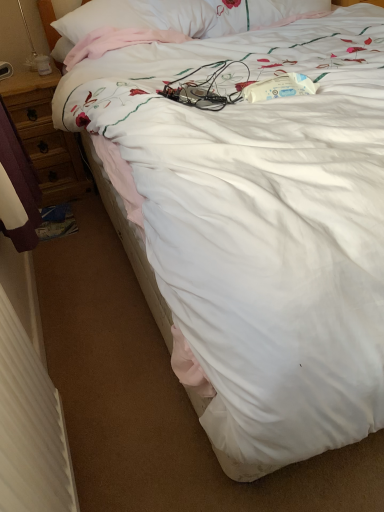
Question: Is wooden desk at left taller or shorter than white textured radiator at lower left?

Choices:
 (A) tall
 (B) short

Answer: (A)

Question: Looking at the image, does wooden desk at left seem bigger or smaller compared to white textured radiator at lower left?

Choices:
 (A) small
 (B) big

Answer: (B)

Question: In the image, is wooden desk at left on the left side or the right side of white textured radiator at lower left?

Choices:
 (A) left
 (B) right

Answer: (A)

Question: Considering the positions of white textured radiator at lower left and wooden desk at left in the image, is white textured radiator at lower left wider or thinner than wooden desk at left?

Choices:
 (A) wide
 (B) thin

Answer: (B)

Question: From a real-world perspective, is white textured radiator at lower left physically located above or below wooden desk at left?

Choices:
 (A) below
 (B) above

Answer: (B)

Question: Looking at the image, does white textured radiator at lower left seem bigger or smaller compared to wooden desk at left?

Choices:
 (A) big
 (B) small

Answer: (B)

Question: Is point (21, 410) positioned closer to the camera than point (14, 74)?

Choices:
 (A) closer
 (B) farther

Answer: (A)